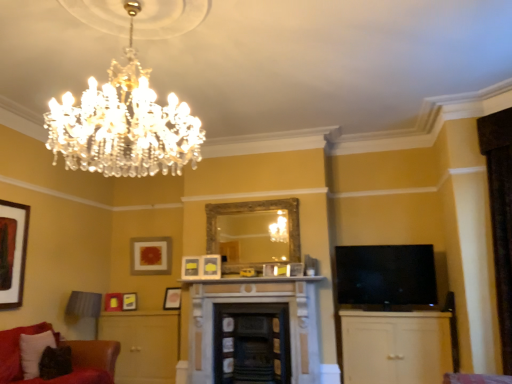
Measure the distance between point [284,325] and camera.

They are 5.05 meters apart.

What do you see at coordinates (251, 344) in the screenshot? This screenshot has height=384, width=512. I see `smooth black fireplace at center, positioned as the first fireplace in right-to-left order` at bounding box center [251, 344].

In order to click on matte gold picture frame at upper center, placed as the 8th picture frame when sorted from front to back in this screenshot , I will do `click(151, 256)`.

Measure the distance between matte gold picture frame at lower left, the seventh picture frame positioned from the front, and camera.

matte gold picture frame at lower left, the seventh picture frame positioned from the front, is 19.27 feet from camera.

Locate an element on the screen. matte black picture frame at left, the 8th picture frame when ordered from right to left is located at coordinates (12, 252).

Considering the sizes of velvet fabric swivel chair at lower left and matte yellow picture frame at lower left, the sixth picture frame when ordered from front to back, in the image, is velvet fabric swivel chair at lower left bigger or smaller than matte yellow picture frame at lower left, the sixth picture frame when ordered from front to back,?

Clearly, velvet fabric swivel chair at lower left is larger in size than matte yellow picture frame at lower left, the sixth picture frame when ordered from front to back.

Which is closer, (72, 314) or (126, 293)?

The point (72, 314) is in front.

Does velvet fabric swivel chair at lower left have a lesser height compared to matte yellow picture frame at lower left, which appears as the 3th picture frame when viewed from the back?

In fact, velvet fabric swivel chair at lower left may be taller than matte yellow picture frame at lower left, which appears as the 3th picture frame when viewed from the back.

Is velvet fabric swivel chair at lower left oriented towards matte yellow picture frame at lower left, the sixth picture frame when ordered from front to back?

No, velvet fabric swivel chair at lower left is not facing towards matte yellow picture frame at lower left, the sixth picture frame when ordered from front to back.

Would you say crystal glass chandelier at upper left is part of matte yellow picture frame at center, which is counted as the 3th picture frame, starting from the front,'s contents?

Definitely not — crystal glass chandelier at upper left is not inside matte yellow picture frame at center, which is counted as the 3th picture frame, starting from the front.

In the image, there is a matte yellow picture frame at center, arranged as the 2th picture frame when viewed from the right. Identify the location of chandelier above it (from the image's perspective). This screenshot has width=512, height=384. (124, 123).

From a real-world perspective, between matte yellow picture frame at center, arranged as the 2th picture frame when viewed from the right, and crystal glass chandelier at upper left, who is vertically lower?

matte yellow picture frame at center, arranged as the 2th picture frame when viewed from the right, is physically lower.

In the scene shown: Can you tell me how much matte yellow picture frame at center, arranged as the 7th picture frame when viewed from the left, and crystal glass chandelier at upper left differ in facing direction?

The angular difference between matte yellow picture frame at center, arranged as the 7th picture frame when viewed from the left, and crystal glass chandelier at upper left is 106 degrees.

Looking at this image, from the image's perspective, is crystal glass chandelier at upper left under matte gold picture frame at center, which is the fifth picture frame in left-to-right order?

No.

Where is `the 6th picture frame below the crystal glass chandelier at upper left (from the image's perspective)`? the 6th picture frame below the crystal glass chandelier at upper left (from the image's perspective) is located at coordinates (172, 298).

Between crystal glass chandelier at upper left and matte gold picture frame at center, acting as the 5th picture frame starting from the front, which one has larger width?

crystal glass chandelier at upper left.

From a real-world perspective, is crystal glass chandelier at upper left located beneath matte gold picture frame at center, the fourth picture frame from the right?

No.

Which of these two, velvet dark brown pillow at lower left or white marble fireplace at center, stands shorter?

With less height is white marble fireplace at center.

Which is further, (40, 337) or (306, 278)?

Positioned behind is point (306, 278).

In the scene shown: Considering the sizes of velvet dark brown pillow at lower left and white marble fireplace at center in the image, is velvet dark brown pillow at lower left bigger or smaller than white marble fireplace at center?

velvet dark brown pillow at lower left is bigger than white marble fireplace at center.

Locate an element on the screen. The width and height of the screenshot is (512, 384). dresser below the matte yellow picture frame at lower left, the sixth picture frame when ordered from front to back (from the image's perspective) is located at coordinates (143, 344).

Considering the sizes of matte wood dresser at lower left and matte yellow picture frame at lower left, acting as the sixth picture frame starting from the right, in the image, is matte wood dresser at lower left taller or shorter than matte yellow picture frame at lower left, acting as the sixth picture frame starting from the right,?

Considering their sizes, matte wood dresser at lower left has more height than matte yellow picture frame at lower left, acting as the sixth picture frame starting from the right.

From a real-world perspective, is matte wood dresser at lower left under matte yellow picture frame at lower left, acting as the sixth picture frame starting from the right?

Yes, from a real-world perspective, matte wood dresser at lower left is below matte yellow picture frame at lower left, acting as the sixth picture frame starting from the right.

Between matte wood dresser at lower left and matte yellow picture frame at lower left, the sixth picture frame when ordered from front to back, which one appears on the right side from the viewer's perspective?

matte wood dresser at lower left.

From a real-world perspective, which is physically below, matte yellow picture frame at lower left, arranged as the 3th picture frame when viewed from the left, or black glossy tv at right?

In real-world perspective, matte yellow picture frame at lower left, arranged as the 3th picture frame when viewed from the left, is lower.

In the scene shown: Which object is thinner, matte yellow picture frame at lower left, the sixth picture frame when ordered from front to back, or black glossy tv at right?

With smaller width is matte yellow picture frame at lower left, the sixth picture frame when ordered from front to back.

Relative to black glossy tv at right, is matte yellow picture frame at lower left, acting as the sixth picture frame starting from the right, in front or behind?

matte yellow picture frame at lower left, acting as the sixth picture frame starting from the right, is behind black glossy tv at right.

Is point (127, 297) closer or farther from the camera than point (341, 291)?

Point (127, 297).

Is matte yellow picture frame at lower left, arranged as the 3th picture frame when viewed from the left, not within dark gray stone fireplace at center, which is the 1th fireplace from left to right?

That's correct, matte yellow picture frame at lower left, arranged as the 3th picture frame when viewed from the left, is outside of dark gray stone fireplace at center, which is the 1th fireplace from left to right.

Based on the photo, is matte yellow picture frame at lower left, which appears as the 3th picture frame when viewed from the back, wider than dark gray stone fireplace at center, which is the 1th fireplace from left to right?

No.

In the image, is matte yellow picture frame at lower left, arranged as the 3th picture frame when viewed from the left, positioned in front of or behind dark gray stone fireplace at center, the 2th fireplace in the right-to-left sequence?

matte yellow picture frame at lower left, arranged as the 3th picture frame when viewed from the left, is behind dark gray stone fireplace at center, the 2th fireplace in the right-to-left sequence.

Where is `swivel chair lying below the matte yellow picture frame at lower left, which appears as the 3th picture frame when viewed from the back (from the image's perspective)`? swivel chair lying below the matte yellow picture frame at lower left, which appears as the 3th picture frame when viewed from the back (from the image's perspective) is located at coordinates (85, 306).

Locate an element on the screen. The image size is (512, 384). chandelier above the matte yellow picture frame at center, which is counted as the 3th picture frame, starting from the front (from a real-world perspective) is located at coordinates (124, 123).

When comparing their distances from matte gold picture frame at center, acting as the fourth picture frame starting from the back, does velvet dark brown pillow at lower left or black glossy tv at right seem closer?

velvet dark brown pillow at lower left.

Based on their spatial positions, is matte gold picture frame at lower left, which is counted as the 2th picture frame, starting from the back, or matte yellow picture frame at center, which is counted as the 3th picture frame, starting from the front, further from matte wood dresser at lower left?

The object further to matte wood dresser at lower left is matte yellow picture frame at center, which is counted as the 3th picture frame, starting from the front.

When comparing their distances from matte gold picture frame at lower left, which is counted as the second picture frame, starting from the left, does matte yellow picture frame at center, the 6th picture frame in the back-to-front sequence, or white marble fireplace at center seem further?

Based on the image, white marble fireplace at center appears to be further to matte gold picture frame at lower left, which is counted as the second picture frame, starting from the left.

From the image, which object appears to be nearer to white marble fireplace at center, velvet dark brown pillow at lower left or velvet fabric swivel chair at lower left?

Based on the image, velvet fabric swivel chair at lower left appears to be nearer to white marble fireplace at center.

Considering their positions, is dark gray stone fireplace at center, which is the 1th fireplace from left to right, positioned further to matte gold picture frame at lower left, the 7th picture frame in the right-to-left sequence, than velvet fabric swivel chair at lower left?

Among the two, dark gray stone fireplace at center, which is the 1th fireplace from left to right, is located further to matte gold picture frame at lower left, the 7th picture frame in the right-to-left sequence.

Considering their positions, is crystal glass chandelier at upper left positioned closer to velvet red couch at lower left than matte gold picture frame at center, which is the fifth picture frame in left-to-right order?

matte gold picture frame at center, which is the fifth picture frame in left-to-right order.

Which object lies further to the anchor point white marble fireplace at center, white wood cabinet at lower right or matte yellow picture frame at lower left, arranged as the 3th picture frame when viewed from the left?

matte yellow picture frame at lower left, arranged as the 3th picture frame when viewed from the left, is positioned further to the anchor white marble fireplace at center.

Looking at the image, which one is located closer to matte white picture frame at center, the 2th picture frame when ordered from front to back, matte yellow picture frame at center, the 6th picture frame in the back-to-front sequence, or matte yellow picture frame at center, the 4th picture frame viewed from the front?

matte yellow picture frame at center, the 6th picture frame in the back-to-front sequence, is positioned closer to the anchor matte white picture frame at center, the 2th picture frame when ordered from front to back.

I want to click on dresser between matte yellow picture frame at lower left, acting as the sixth picture frame starting from the right, and matte yellow picture frame at center, arranged as the 7th picture frame when viewed from the left, from left to right, so click(x=143, y=344).

Locate an element on the screen. This screenshot has width=512, height=384. cabinetry between crystal glass chandelier at upper left and matte gold picture frame at lower left, which is counted as the second picture frame, starting from the left, from front to back is located at coordinates (395, 347).

Identify the location of studio couch between velvet dark brown pillow at lower left and white marble fireplace at center from left to right. The height and width of the screenshot is (384, 512). (72, 356).

The image size is (512, 384). What are the coordinates of `swivel chair between velvet dark brown pillow at lower left and matte white picture frame at center, the 8th picture frame positioned from the left, from left to right` in the screenshot? It's located at (85, 306).